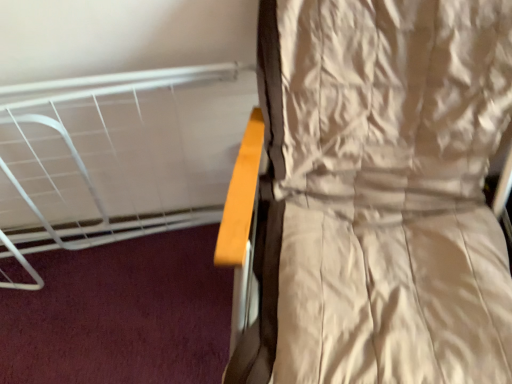
Question: From the image's perspective, is beige satin curtain at right located above or below white matte bed at upper left?

Choices:
 (A) above
 (B) below

Answer: (B)

Question: Is beige satin curtain at right situated inside white matte bed at upper left or outside?

Choices:
 (A) outside
 (B) inside

Answer: (A)

Question: From a real-world perspective, relative to white matte bed at upper left, is beige satin curtain at right vertically above or below?

Choices:
 (A) below
 (B) above

Answer: (B)

Question: From a real-world perspective, is white matte bed at upper left physically located above or below beige satin curtain at right?

Choices:
 (A) above
 (B) below

Answer: (B)

Question: Is white matte bed at upper left in front of or behind beige satin curtain at right in the image?

Choices:
 (A) behind
 (B) front

Answer: (A)

Question: Considering the positions of point (119, 180) and point (348, 329), is point (119, 180) closer or farther from the camera than point (348, 329)?

Choices:
 (A) closer
 (B) farther

Answer: (B)

Question: From the image's perspective, is white matte bed at upper left positioned above or below beige satin curtain at right?

Choices:
 (A) below
 (B) above

Answer: (B)